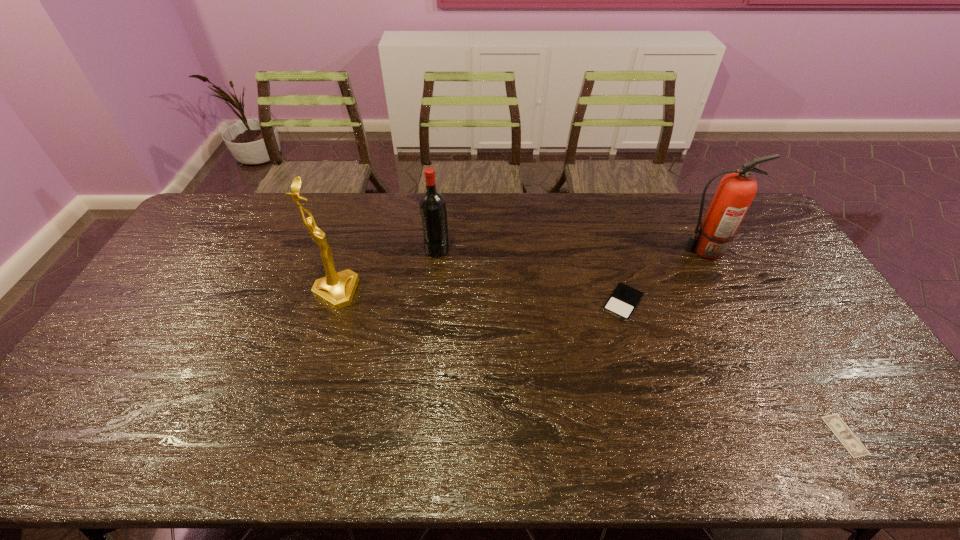
What are the coordinates of `free space located 0.080m on the nozzle of the fire extinguisher` in the screenshot? It's located at (655, 251).

Find the location of `vacant space located 0.070m on the nozzle of the fire extinguisher`. vacant space located 0.070m on the nozzle of the fire extinguisher is located at coordinates (658, 251).

At what (x,y) coordinates should I click in order to perform the action: click on vacant space located on the right of the third tallest object. Please return your answer as a coordinate pair (x, y). The width and height of the screenshot is (960, 540). Looking at the image, I should click on (555, 248).

Image resolution: width=960 pixels, height=540 pixels. Identify the location of vacant space located 0.130m on the front of the second shortest object. (639, 360).

Where is `blank space located on the back of the shortest object`? The width and height of the screenshot is (960, 540). blank space located on the back of the shortest object is located at coordinates (790, 343).

Where is `object located in the near edge section of the desktop`? object located in the near edge section of the desktop is located at coordinates (847, 438).

You are a GUI agent. You are given a task and a screenshot of the screen. Output one action in this format:
    pyautogui.click(x=<x>, y=<y>)
    Task: Click on the object at the right edge
    This screenshot has width=960, height=540.
    Given the screenshot: What is the action you would take?
    pyautogui.click(x=847, y=438)

You are a GUI agent. You are given a task and a screenshot of the screen. Output one action in this format:
    pyautogui.click(x=<x>, y=<y>)
    Task: Click on the object at the near right corner
    
    Given the screenshot: What is the action you would take?
    tap(847, 438)

Where is `vacant area at the far edge`? Image resolution: width=960 pixels, height=540 pixels. vacant area at the far edge is located at coordinates click(x=387, y=198).

Identify the location of free location at the near edge of the desktop. (212, 441).